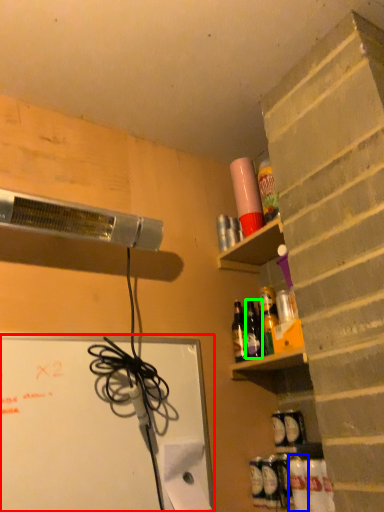
Question: Estimate the real-world distances between objects in this image. Which object is farther from bulletin board (highlighted by a red box), bottle (highlighted by a blue box) or bottle (highlighted by a green box)?

Choices:
 (A) bottle
 (B) bottle

Answer: (A)